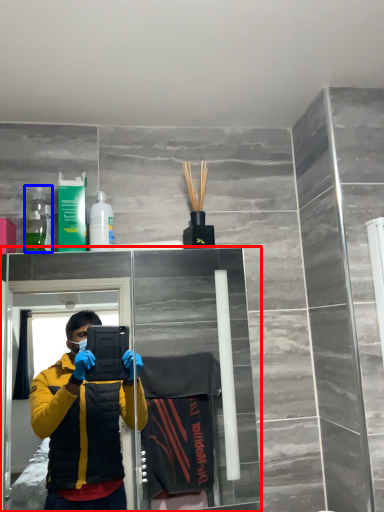
Question: Which object appears farthest to the camera in this image, glass door (highlighted by a red box) or bottle (highlighted by a blue box)?

Choices:
 (A) glass door
 (B) bottle

Answer: (B)